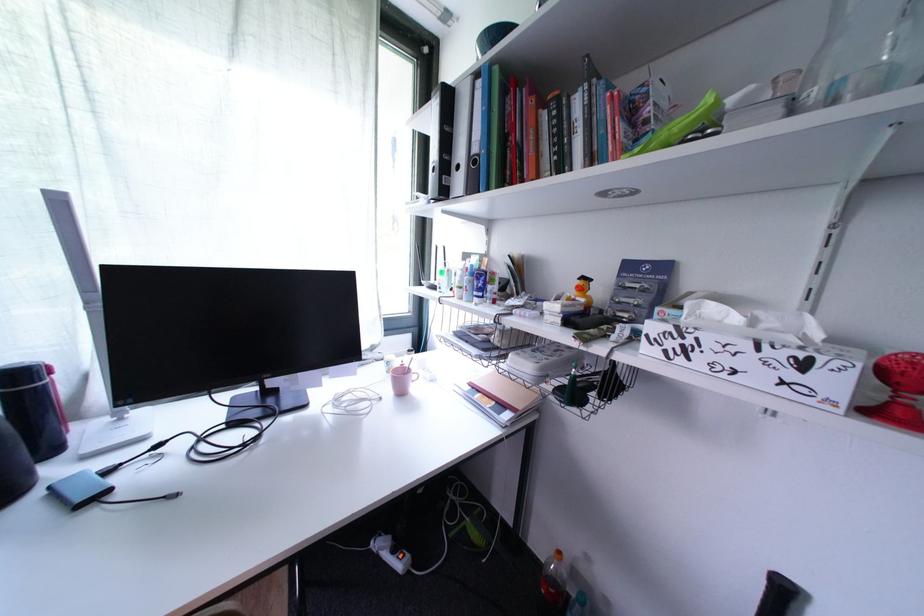
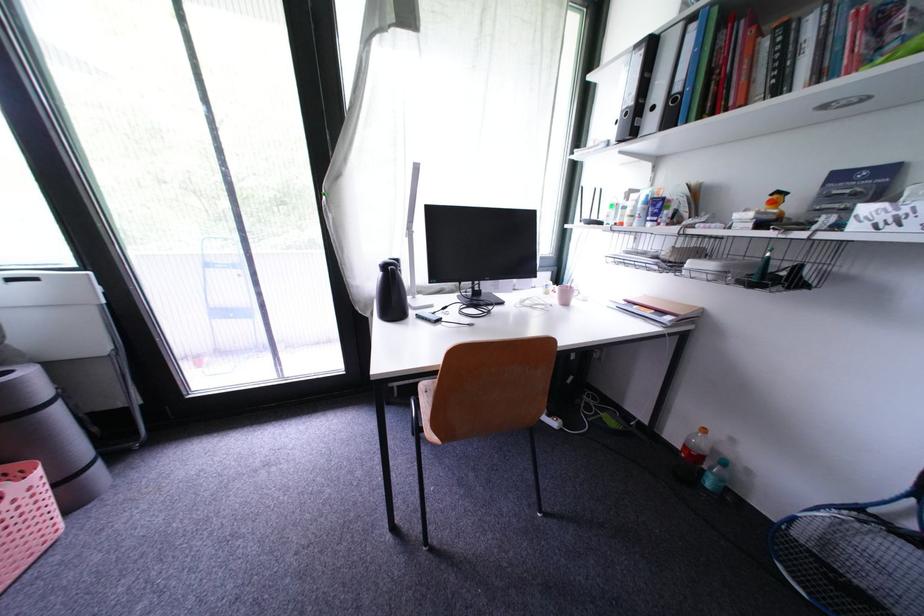
Locate, in the second image, the point that corresponds to the point at 528,408 in the first image.

(689, 315)